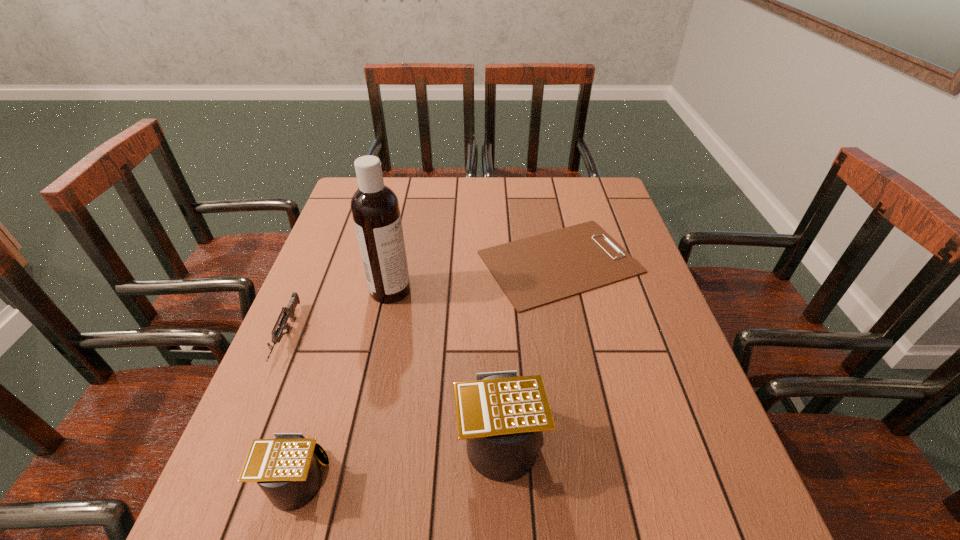
This screenshot has width=960, height=540. What are the coordinates of `vacant space at the right edge of the desktop` in the screenshot? It's located at (606, 319).

I want to click on vacant point at the far left corner, so click(356, 179).

This screenshot has width=960, height=540. Identify the location of blank space at the far right corner of the desktop. (613, 205).

Image resolution: width=960 pixels, height=540 pixels. I want to click on vacant point located between the third shortest object and the tallest object, so click(344, 383).

This screenshot has width=960, height=540. I want to click on free area in between the dishwasher detergent and the fourth tallest object, so click(x=339, y=313).

Where is `vacant area between the taller calculator and the tallest object`? The height and width of the screenshot is (540, 960). vacant area between the taller calculator and the tallest object is located at coordinates (444, 363).

The height and width of the screenshot is (540, 960). I want to click on free space between the shortest object and the left calculator, so pos(428,369).

Where is `vacant point located between the left calculator and the clipboard`? vacant point located between the left calculator and the clipboard is located at coordinates (428, 369).

Locate an element on the screen. The image size is (960, 540). vacant space that is in between the third tallest object and the clipboard is located at coordinates (428, 369).

Where is `free area in between the dishwasher detergent and the leftmost object`? free area in between the dishwasher detergent and the leftmost object is located at coordinates (339, 313).